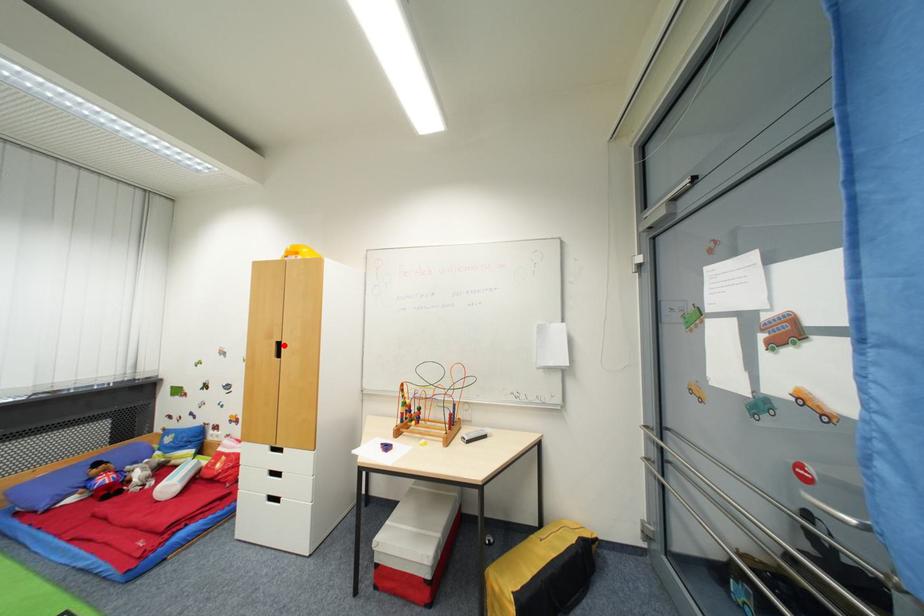
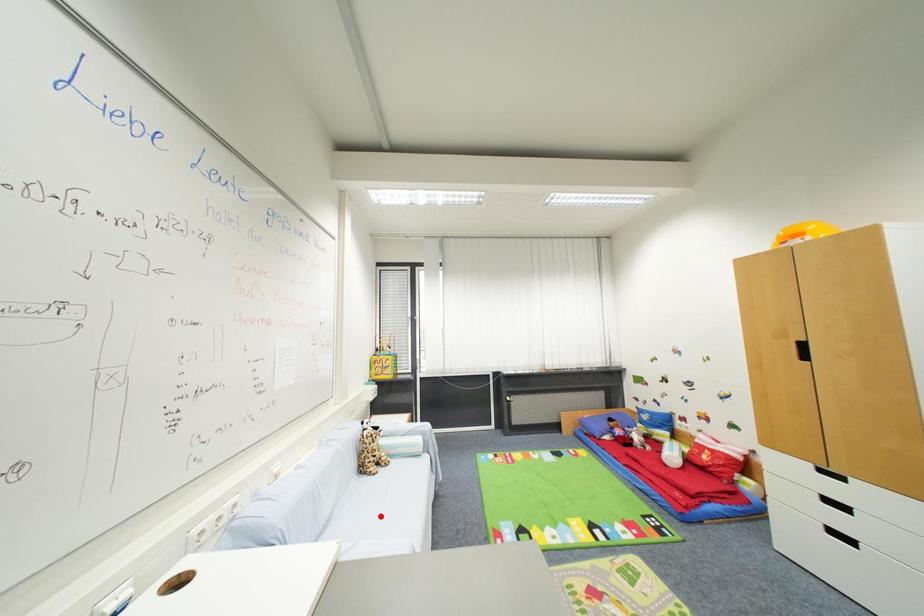
I am providing you with two images of the same scene from different viewpoints. A red point is marked on the first image and another point is marked on the second image. Is the red point in image1 aligned with the point shown in image2?

No